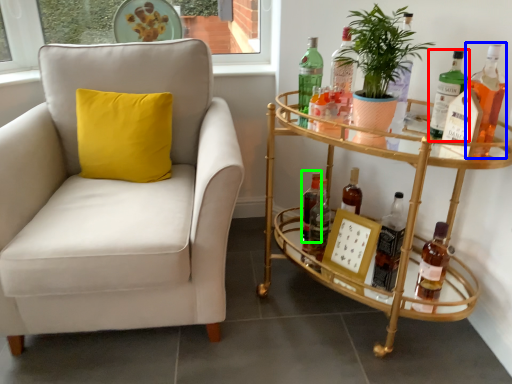
Question: Considering the real-world distances, which object is closest to bottle (highlighted by a red box)? bottle (highlighted by a blue box) or bottle (highlighted by a green box).

Choices:
 (A) bottle
 (B) bottle

Answer: (A)